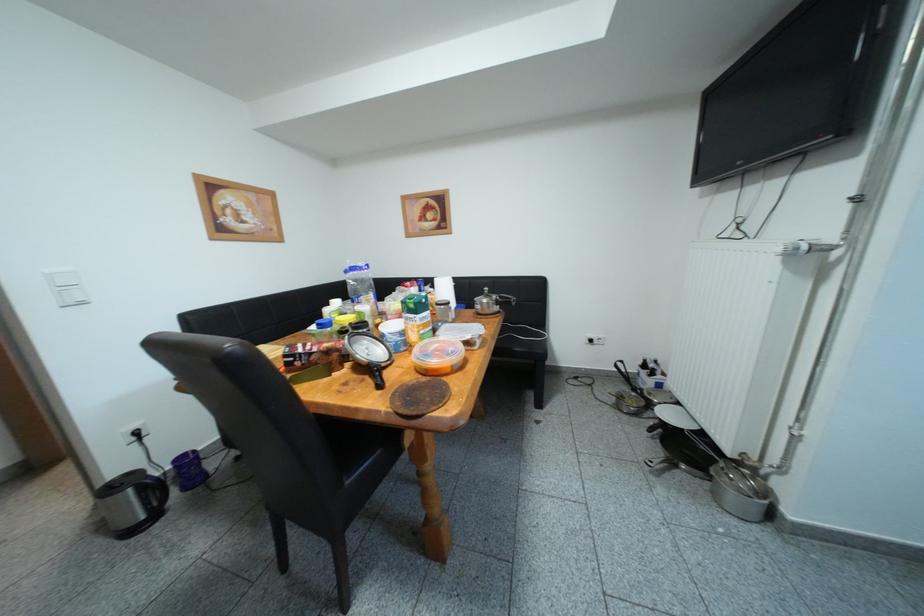
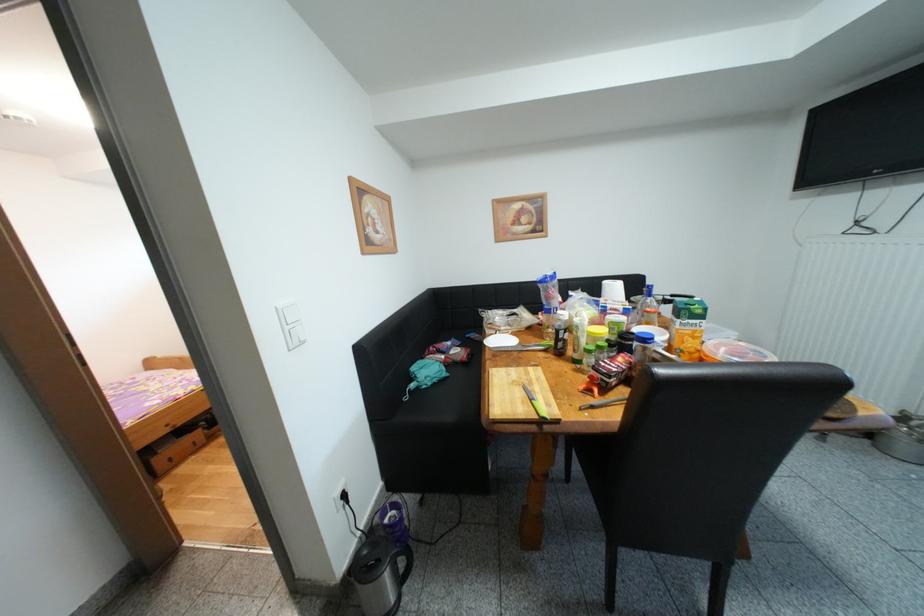
Question: In a continuous first-person perspective shot, in which direction is the camera moving?

Choices:
 (A) Left
 (B) Right
 (C) Forward
 (D) Backward

Answer: (A)